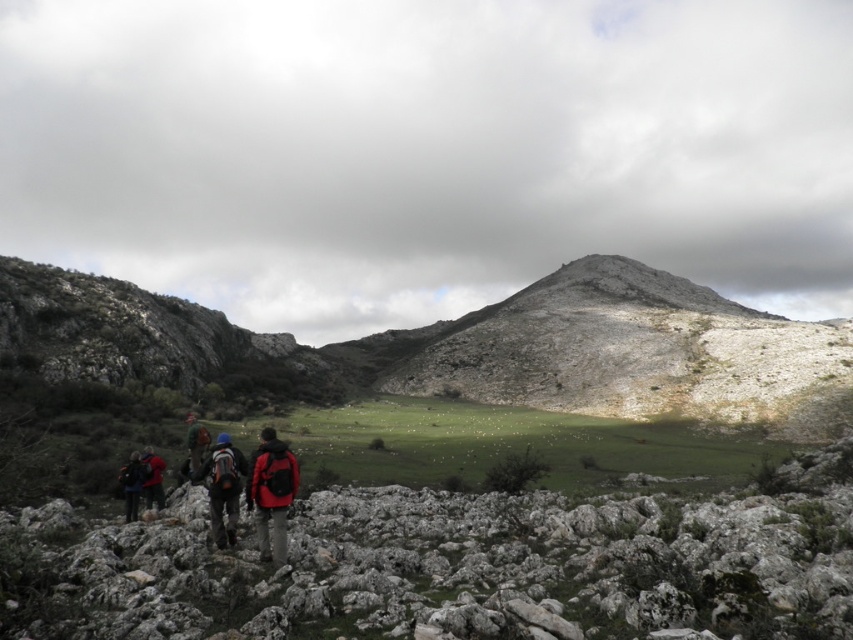
Question: Can you confirm if matte black backpack at lower left is positioned to the left of red jacket at center?

Choices:
 (A) no
 (B) yes

Answer: (A)

Question: Is rough stone boulders at lower left above matte red backpack at center?

Choices:
 (A) no
 (B) yes

Answer: (B)

Question: Which point is closer to the camera taking this photo?

Choices:
 (A) (212, 458)
 (B) (194, 419)

Answer: (A)

Question: Does matte black backpack at center appear on the left side of red matte jacket at lower left?

Choices:
 (A) yes
 (B) no

Answer: (B)

Question: Estimate the real-world distances between objects in this image. Which object is farther from the matte red backpack at center?

Choices:
 (A) matte black backpack at center
 (B) matte black backpack at lower left
 (C) rugged stone mountain at center
 (D) rough stone boulders at lower left

Answer: (C)

Question: Which point is farther from the camera taking this photo?

Choices:
 (A) (149, 467)
 (B) (270, 548)
 (C) (647, 513)
 (D) (138, 486)

Answer: (A)